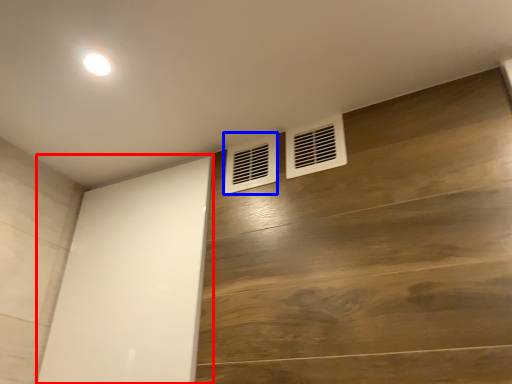
Question: Among these objects, which one is nearest to the camera, screen door (highlighted by a red box) or air conditioning (highlighted by a blue box)?

Choices:
 (A) screen door
 (B) air conditioning

Answer: (A)